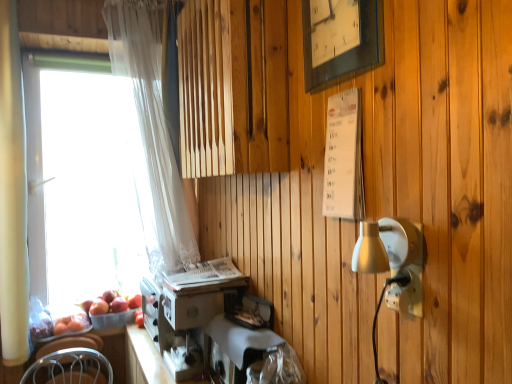
Where is `free spot above white fabric-covered sewing machine at lower center (from a real-world perspective)`? This screenshot has height=384, width=512. free spot above white fabric-covered sewing machine at lower center (from a real-world perspective) is located at coordinates (246, 325).